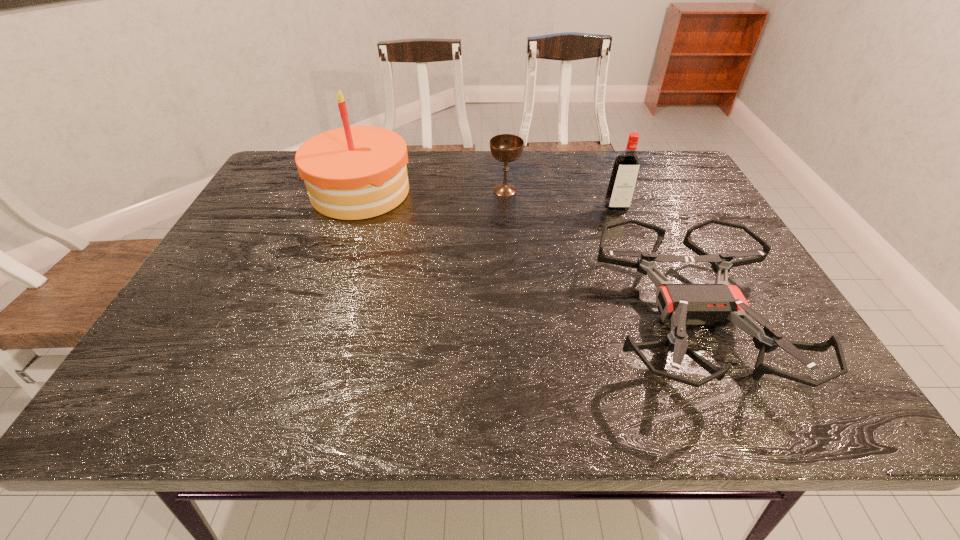
At what (x,y) coordinates should I click in order to perform the action: click on birthday cake. Please return your answer as a coordinate pair (x, y). Looking at the image, I should click on (355, 172).

The width and height of the screenshot is (960, 540). Find the location of `the tallest object`. the tallest object is located at coordinates (355, 172).

This screenshot has height=540, width=960. I want to click on the third shortest object, so click(x=626, y=167).

The image size is (960, 540). Find the location of `the second object from left to right`. the second object from left to right is located at coordinates click(505, 148).

This screenshot has height=540, width=960. In order to click on chalice in this screenshot , I will do `click(505, 148)`.

Image resolution: width=960 pixels, height=540 pixels. Identify the location of drone. (717, 304).

Identify the location of the shortest object. (717, 304).

Image resolution: width=960 pixels, height=540 pixels. I want to click on vacant point located on the front of the birthday cake, so (x=344, y=239).

Where is `blank space located 0.270m on the front and back of the second tallest object`? blank space located 0.270m on the front and back of the second tallest object is located at coordinates (645, 281).

What are the coordinates of `vacant space located on the right of the chalice` in the screenshot? It's located at (637, 190).